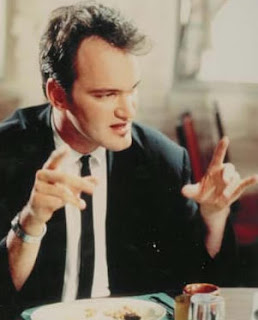
Where is `jar`? Image resolution: width=258 pixels, height=320 pixels. jar is located at coordinates (196, 306).